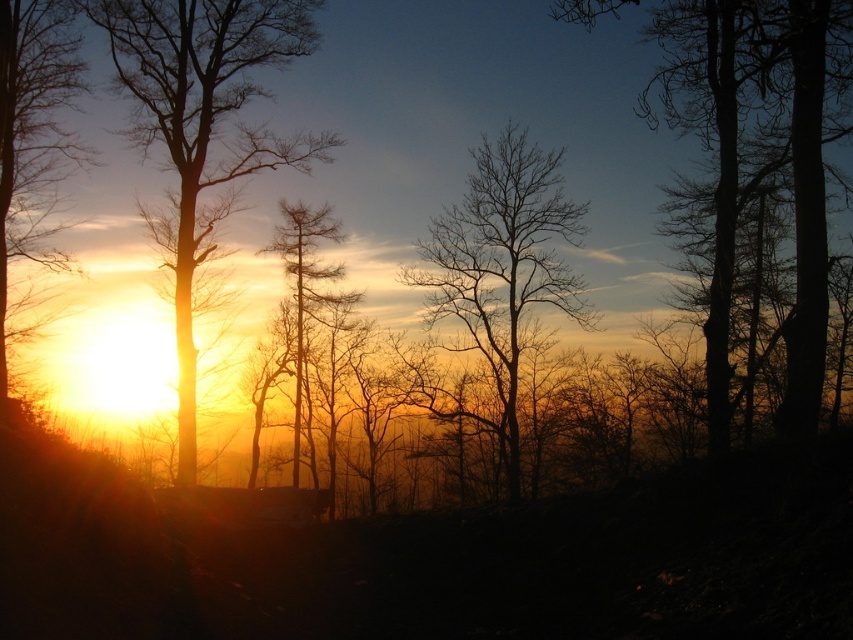
Is silhouette bare tree at left above bare branches at center?

Indeed, silhouette bare tree at left is positioned over bare branches at center.

Is point (184, 449) farther from camera compared to point (477, 316)?

That is False.

The height and width of the screenshot is (640, 853). Find the location of `silhouette bare tree at left`. silhouette bare tree at left is located at coordinates (202, 125).

Does silhouette bark tree at right have a larger size compared to silvery textured pine tree at center?

Yes, silhouette bark tree at right is bigger than silvery textured pine tree at center.

Consider the image. Is silhouette bark tree at right to the right of silvery textured pine tree at center from the viewer's perspective?

Yes, silhouette bark tree at right is to the right of silvery textured pine tree at center.

What do you see at coordinates (759, 156) in the screenshot? I see `silhouette bark tree at right` at bounding box center [759, 156].

This screenshot has width=853, height=640. I want to click on silhouette bark tree at right, so click(759, 156).

In the scene shown: Which is above, silhouette bare tree at left or matte orange sun at left?

silhouette bare tree at left is above.

Who is more distant from viewer, (181,170) or (6,330)?

Positioned behind is point (6,330).

Is point (247, 6) in front of point (73, 35)?

Yes.

This screenshot has width=853, height=640. In order to click on silhouette bare tree at left in this screenshot , I will do `click(202, 125)`.